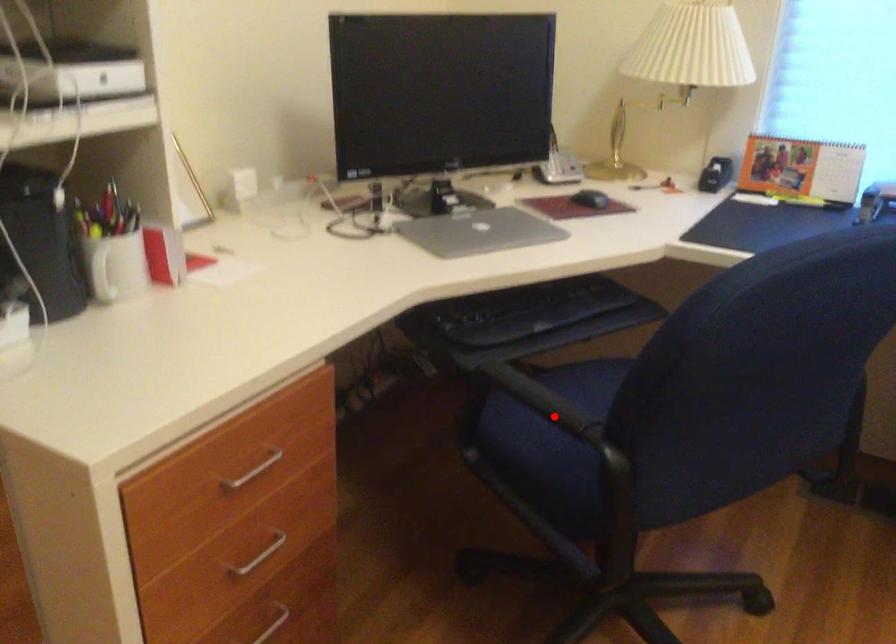
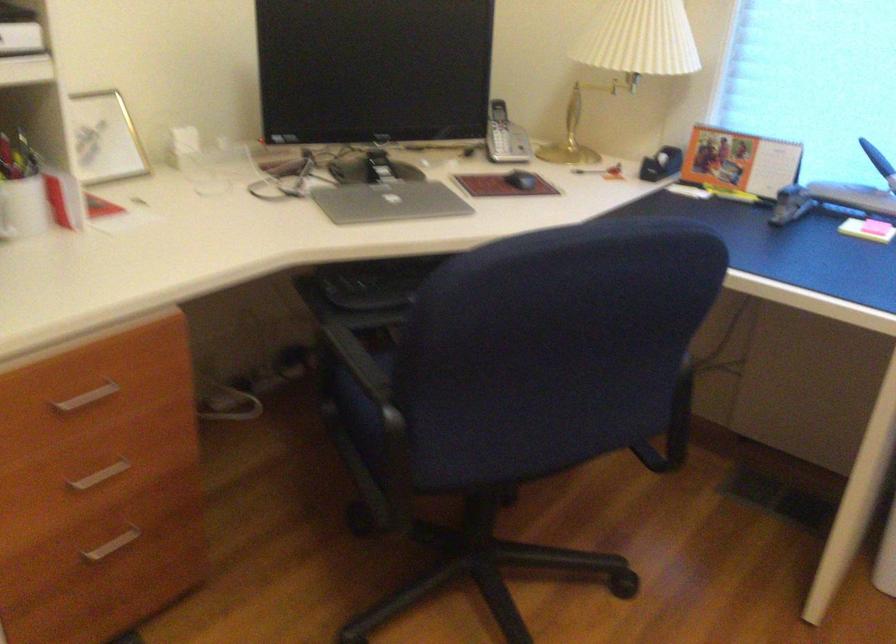
In the second image, find the point that corresponds to the highlighted location in the first image.

(365, 375)